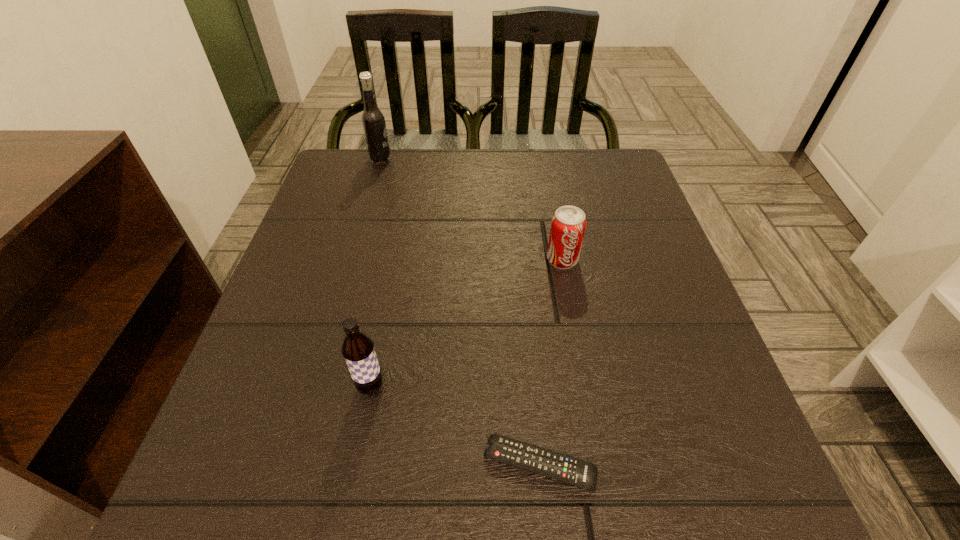
At what (x,y) coordinates should I click in order to perform the action: click on unoccupied position between the left root beer and the remote control. Please return your answer as a coordinate pair (x, y). The image size is (960, 540). Looking at the image, I should click on (460, 312).

Locate which object is the second closest to the third tallest object. Please provide its 2D coordinates. Your answer should be formatted as a tuple, i.e. [(x, y)], where the tuple contains the x and y coordinates of a point satisfying the conditions above.

[(358, 350)]

The height and width of the screenshot is (540, 960). Find the location of `object that is the second closest one to the second tallest object`. object that is the second closest one to the second tallest object is located at coordinates (568, 224).

Where is `blank space that satisfies the following two spatial constraints: 1. on the back side of the shorter root beer; 2. on the label of the tallest object`? This screenshot has height=540, width=960. blank space that satisfies the following two spatial constraints: 1. on the back side of the shorter root beer; 2. on the label of the tallest object is located at coordinates (415, 160).

At what (x,y) coordinates should I click in order to perform the action: click on free space that satisfies the following two spatial constraints: 1. on the label of the third nearest object; 2. on the left side of the tallest object. Please return your answer as a coordinate pair (x, y). The height and width of the screenshot is (540, 960). Looking at the image, I should click on (351, 260).

You are a GUI agent. You are given a task and a screenshot of the screen. Output one action in this format:
    pyautogui.click(x=<x>, y=<y>)
    Task: Click on the free space that satisfies the following two spatial constraints: 1. on the label of the tallest object; 2. on the back side of the remote control
    This screenshot has width=960, height=540.
    Given the screenshot: What is the action you would take?
    pyautogui.click(x=291, y=464)

Locate an element on the screen. vacant area that satisfies the following two spatial constraints: 1. on the label of the leftmost object; 2. on the back side of the shorter root beer is located at coordinates (314, 387).

The height and width of the screenshot is (540, 960). I want to click on free region that satisfies the following two spatial constraints: 1. on the label of the farthest object; 2. on the right side of the second farthest object, so click(351, 260).

Identify the location of vacant space that satisfies the following two spatial constraints: 1. on the label of the farthest object; 2. on the back side of the shortest object. The height and width of the screenshot is (540, 960). (291, 464).

At what (x,y) coordinates should I click in order to perform the action: click on vacant region that satisfies the following two spatial constraints: 1. on the back side of the second tallest object; 2. on the label of the leftmost object. Please return your answer as a coordinate pair (x, y). This screenshot has width=960, height=540. Looking at the image, I should click on (415, 160).